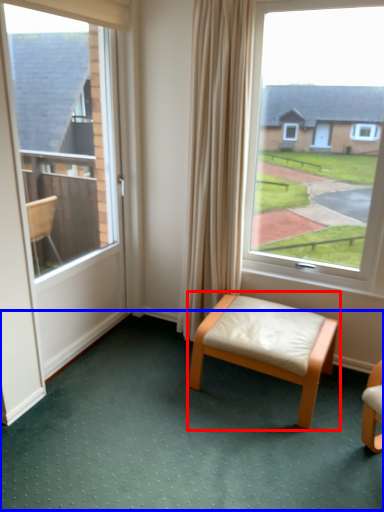
Question: Which object is closer to the camera taking this photo, stool (highlighted by a red box) or golf course (highlighted by a blue box)?

Choices:
 (A) stool
 (B) golf course

Answer: (B)